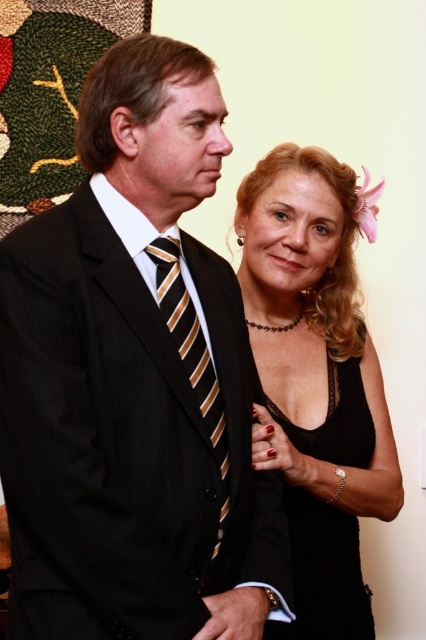
Who is positioned more to the left, matte black suit at center or black lace tank top at center?

Positioned to the left is matte black suit at center.

Can you confirm if matte black suit at center is shorter than black lace tank top at center?

Yes.

Locate an element on the screen. The image size is (426, 640). matte black suit at center is located at coordinates (134, 381).

At what (x,y) coordinates should I click in order to perform the action: click on matte black suit at center. Please return your answer as a coordinate pair (x, y). The width and height of the screenshot is (426, 640). Looking at the image, I should click on (134, 381).

Find the location of a particular element. Image resolution: width=426 pixels, height=640 pixels. black lace dress at right is located at coordinates (324, 572).

Between black lace dress at right and striped silk tie at center, which one is positioned lower?

Positioned lower is black lace dress at right.

Who is more distant from viewer, (339, 390) or (166, 257)?

The point (339, 390) is behind.

Locate an element on the screen. The image size is (426, 640). black lace dress at right is located at coordinates (324, 572).

Can you confirm if matte black suit at center is positioned to the right of striped silk tie at center?

Incorrect, matte black suit at center is not on the right side of striped silk tie at center.

Does point (141, 252) come farther from viewer compared to point (175, 260)?

No, (141, 252) is in front of (175, 260).

At what (x,y) coordinates should I click in order to perform the action: click on matte black suit at center. Please return your answer as a coordinate pair (x, y). The width and height of the screenshot is (426, 640). Looking at the image, I should click on (134, 381).

The width and height of the screenshot is (426, 640). Identify the location of matte black suit at center. click(x=134, y=381).